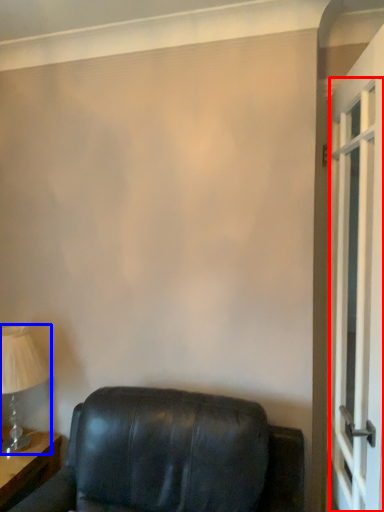
Question: Which point is further to the camera, screen door (highlighted by a red box) or table lamp (highlighted by a blue box)?

Choices:
 (A) screen door
 (B) table lamp

Answer: (B)